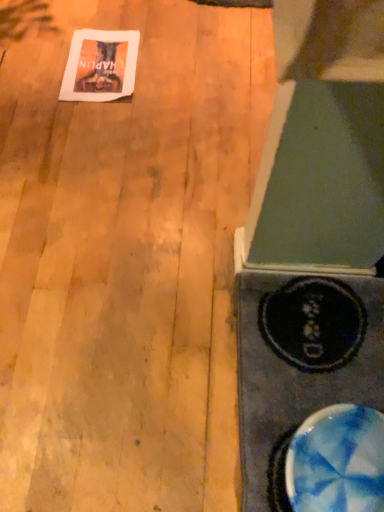
Find the location of a particular element. This screenshot has width=384, height=512. free space to the left of blue marbled bowl at lower right is located at coordinates (202, 435).